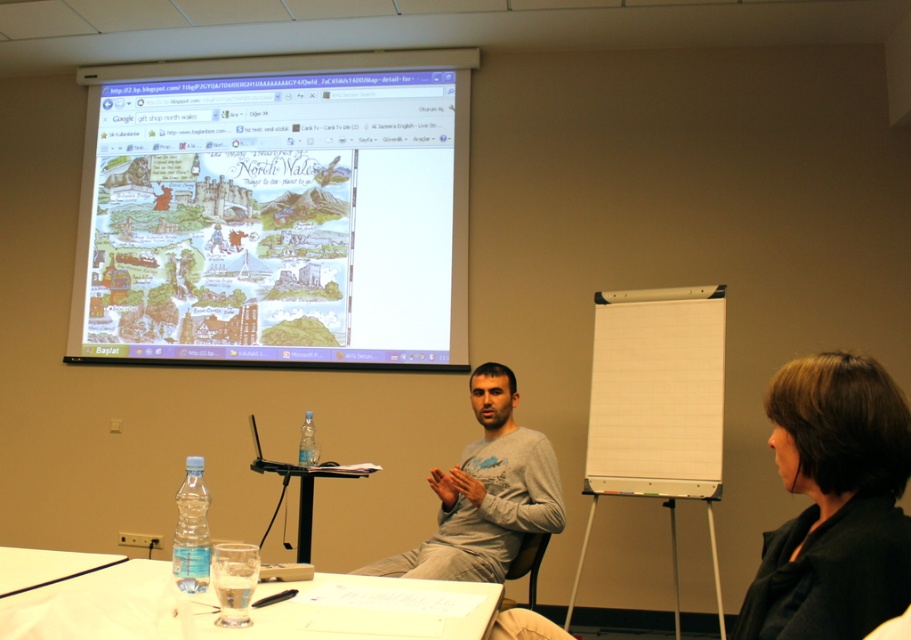
Question: Can you confirm if cartoonish illustration map at upper center is thinner than clear plastic table at lower center?

Choices:
 (A) yes
 (B) no

Answer: (B)

Question: Is black matte jacket at lower right below clear plastic table at lower left?

Choices:
 (A) no
 (B) yes

Answer: (A)

Question: Which of these objects is positioned closest to the black matte jacket at lower right?

Choices:
 (A) gray cotton shirt at center
 (B) black plastic table at center

Answer: (A)

Question: Is black matte jacket at lower right positioned at the back of clear plastic table at lower left?

Choices:
 (A) no
 (B) yes

Answer: (A)

Question: Which object appears farthest from the camera in this image?

Choices:
 (A) cartoonish illustration map at upper center
 (B) gray cotton shirt at center

Answer: (A)

Question: Which point is farther from the camera taking this photo?

Choices:
 (A) (74, 554)
 (B) (306, 550)
 (C) (106, 621)

Answer: (B)